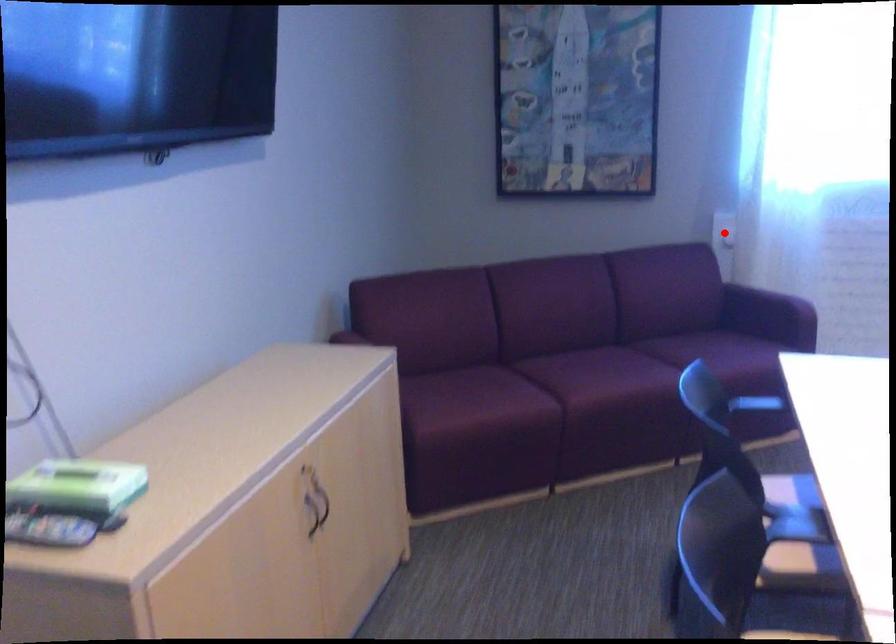
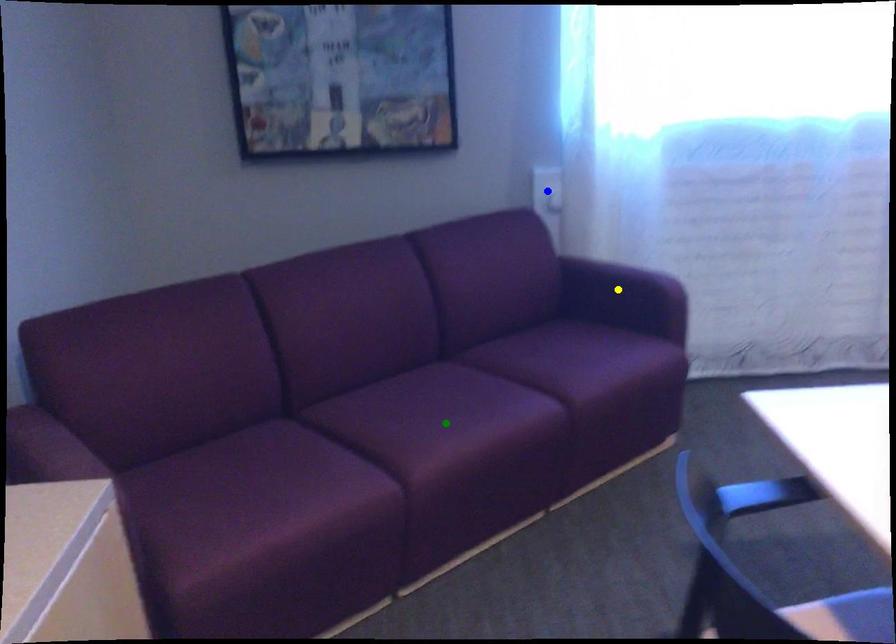
Question: I am providing you with two images of the same scene from different viewpoints. A red point is marked on the first image. You are given multiple points on the second image. In image 2, which mark is for the same physical point as the one in image 1?

Choices:
 (A) green point
 (B) blue point
 (C) yellow point

Answer: (B)